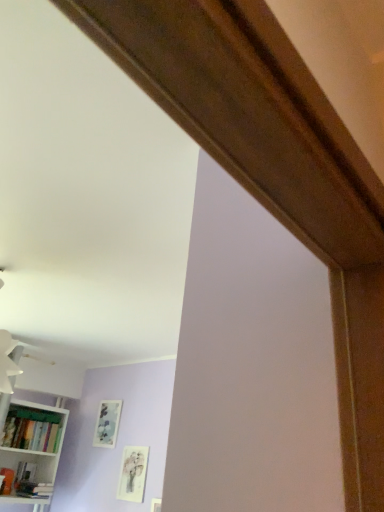
Question: Is matte green bookshelf at lower left located outside white matte bookshelf at lower left?

Choices:
 (A) yes
 (B) no

Answer: (B)

Question: Considering the relative sizes of matte green bookshelf at lower left and white matte bookshelf at lower left in the image provided, is matte green bookshelf at lower left thinner than white matte bookshelf at lower left?

Choices:
 (A) yes
 (B) no

Answer: (A)

Question: From a real-world perspective, is matte green bookshelf at lower left physically below white matte bookshelf at lower left?

Choices:
 (A) no
 (B) yes

Answer: (A)

Question: Does matte green bookshelf at lower left appear on the left side of white matte bookshelf at lower left?

Choices:
 (A) no
 (B) yes

Answer: (A)

Question: Could you tell me if matte green bookshelf at lower left is turned towards white matte bookshelf at lower left?

Choices:
 (A) no
 (B) yes

Answer: (B)

Question: Based on their sizes in the image, would you say white matte bookshelf at lower left is bigger or smaller than matte white picture frame at lower left, arranged as the 1th picture frame when viewed from the front?

Choices:
 (A) big
 (B) small

Answer: (A)

Question: Is white matte bookshelf at lower left situated inside matte white picture frame at lower left, the 2th picture frame from the left, or outside?

Choices:
 (A) outside
 (B) inside

Answer: (A)

Question: Is point pyautogui.click(x=8, y=448) closer or farther from the camera than point pyautogui.click(x=130, y=463)?

Choices:
 (A) closer
 (B) farther

Answer: (A)

Question: From the image's perspective, is white matte bookshelf at lower left located above or below matte white picture frame at lower left, the 2th picture frame from the left?

Choices:
 (A) above
 (B) below

Answer: (A)

Question: From the image's perspective, is matte white picture frame at lower left, which is the 1th picture frame from right to left, above or below white matte bookshelf at lower left?

Choices:
 (A) above
 (B) below

Answer: (B)

Question: From a real-world perspective, is matte white picture frame at lower left, which is the 1th picture frame from right to left, physically located above or below white matte bookshelf at lower left?

Choices:
 (A) below
 (B) above

Answer: (A)

Question: Looking at the image, does matte white picture frame at lower left, the 2th picture frame from the left, seem bigger or smaller compared to white matte bookshelf at lower left?

Choices:
 (A) big
 (B) small

Answer: (B)

Question: Based on their positions, is matte white picture frame at lower left, the 2th picture frame from the left, located to the left or right of white matte bookshelf at lower left?

Choices:
 (A) right
 (B) left

Answer: (A)

Question: Considering the positions of point (92, 444) and point (135, 489), is point (92, 444) closer or farther from the camera than point (135, 489)?

Choices:
 (A) closer
 (B) farther

Answer: (B)

Question: Based on their sizes in the image, would you say matte silver picture frame at center, placed as the first picture frame when sorted from back to front, is bigger or smaller than matte white picture frame at lower left, which is the 1th picture frame from right to left?

Choices:
 (A) big
 (B) small

Answer: (A)